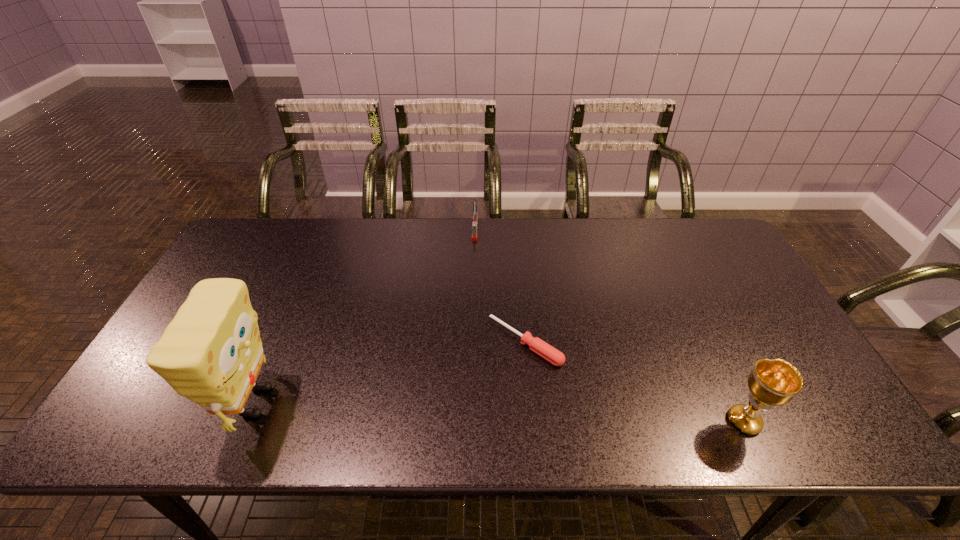
Where is `the leftmost object`? This screenshot has height=540, width=960. the leftmost object is located at coordinates (211, 353).

Where is `the tallest object`? the tallest object is located at coordinates (211, 353).

The width and height of the screenshot is (960, 540). I want to click on chalice, so click(x=775, y=382).

Find the location of a particular element. This screenshot has width=960, height=540. the third shortest object is located at coordinates (775, 382).

The image size is (960, 540). Find the location of `the farthest object`. the farthest object is located at coordinates (475, 214).

Where is `stapler`? stapler is located at coordinates (x=475, y=214).

Identify the location of the shortest object. This screenshot has width=960, height=540. (543, 349).

The width and height of the screenshot is (960, 540). Find the location of `the second object from right to left`. the second object from right to left is located at coordinates click(x=543, y=349).

The height and width of the screenshot is (540, 960). What are the coordinates of `free space located 0.200m on the face of the leftmost object` in the screenshot? It's located at (367, 402).

Find the location of `vacant region located on the back of the rightmost object`. vacant region located on the back of the rightmost object is located at coordinates (692, 313).